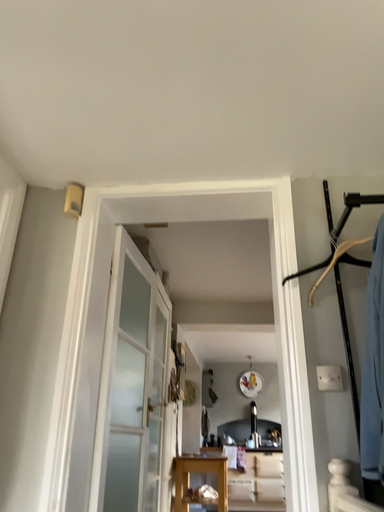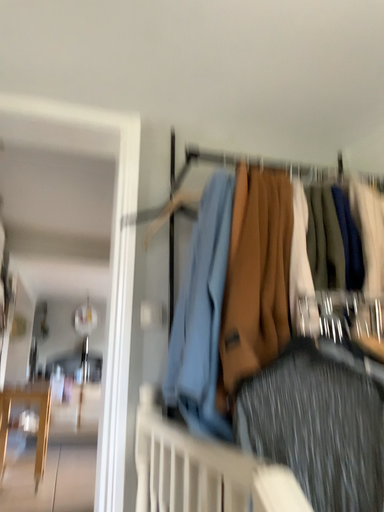
Question: Which way did the camera rotate in the video?

Choices:
 (A) rotated right
 (B) rotated left

Answer: (A)